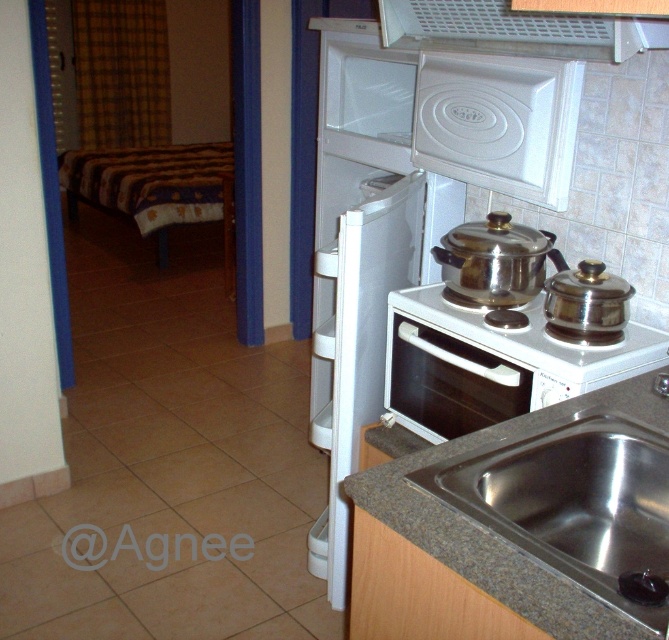
Measure the distance between white glossy gas stove at center and camera.

white glossy gas stove at center and camera are 1.41 meters apart from each other.

Which is above, white glossy gas stove at center or white glossy oven at center?

white glossy gas stove at center

Where is `white glossy gas stove at center`? The height and width of the screenshot is (640, 669). white glossy gas stove at center is located at coordinates (516, 346).

Is point (434, 353) closer to viewer compared to point (597, 49)?

That is False.

Does point (432, 305) come behind point (529, 35)?

No, it is in front of (529, 35).

Where is `white glossy gas stove at center`? This screenshot has height=640, width=669. white glossy gas stove at center is located at coordinates (516, 346).

Between stainless steel stove at center and stainless steel sink at lower right, which one has less height?

stainless steel sink at lower right

Who is lower down, stainless steel stove at center or stainless steel sink at lower right?

stainless steel sink at lower right is lower down.

Who is more forward, (535, 202) or (444, 467)?

Point (444, 467) is in front.

Locate an element on the screen. Image resolution: width=669 pixels, height=640 pixels. stainless steel stove at center is located at coordinates (405, 208).